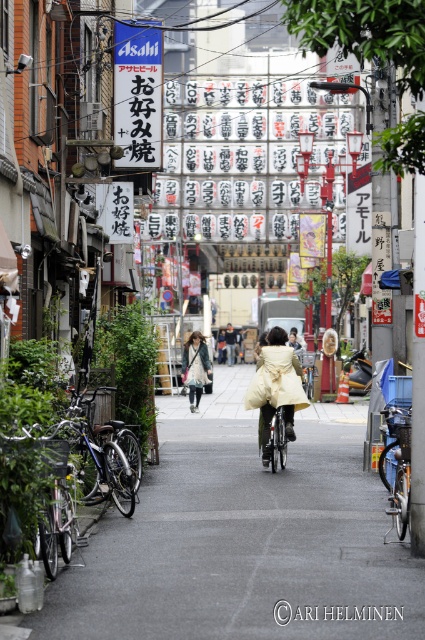
Question: Which point is farther to the camera?

Choices:
 (A) shiny metallic bicycle at center
 (B) matte beige coat at center
 (C) silver metallic bicycle at right
 (D) light beige coat at center

Answer: (D)

Question: Considering the real-world distances, which object is closest to the shiny metallic bicycle at center?

Choices:
 (A) matte beige coat at center
 (B) silver metallic bicycle at right

Answer: (B)

Question: Is smooth asphalt road at center smaller than light beige coat at center?

Choices:
 (A) yes
 (B) no

Answer: (B)

Question: Among these points, which one is farthest from the camera?

Choices:
 (A) (322, 611)
 (B) (399, 403)

Answer: (B)

Question: Is shiny metallic bicycle at center below matte beige coat at center?

Choices:
 (A) no
 (B) yes

Answer: (B)

Question: In this image, where is smooth asphalt road at center located relative to matte beige coat at center?

Choices:
 (A) below
 (B) above

Answer: (A)